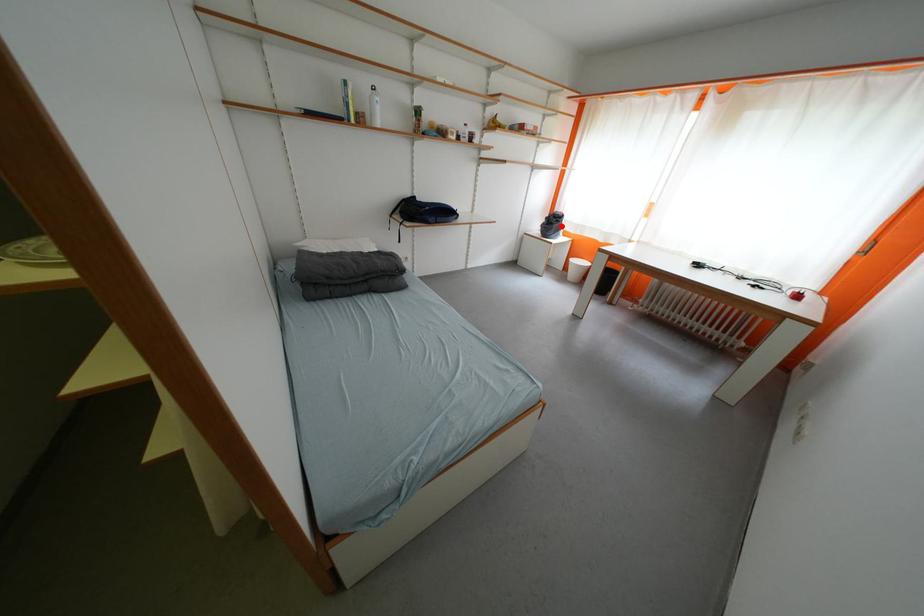
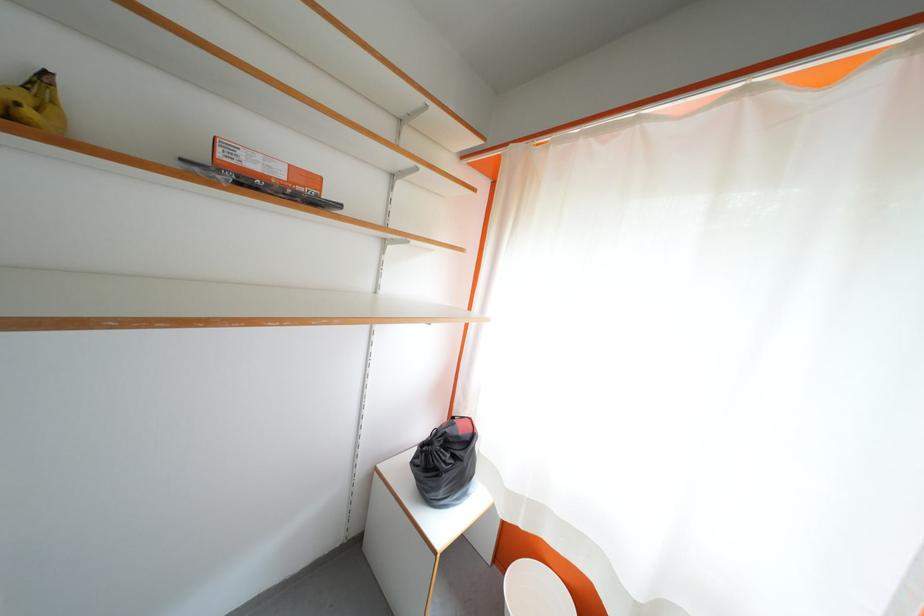
Find the pixel in the second image that matches the highlighted location in the first image.

(455, 460)